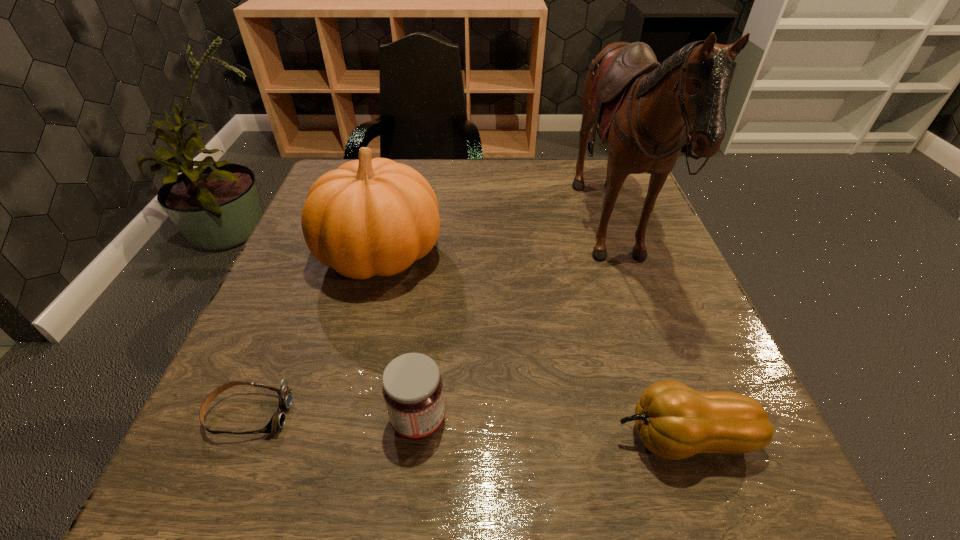
What are the coordinates of `free spot located 0.340m on the stem side of the gourd` in the screenshot? It's located at (379, 438).

You are a GUI agent. You are given a task and a screenshot of the screen. Output one action in this format:
    pyautogui.click(x=<x>, y=<y>)
    Task: Click on the vacant space situated 0.320m on the stem side of the gourd
    The width and height of the screenshot is (960, 540).
    Given the screenshot: What is the action you would take?
    pyautogui.click(x=393, y=438)

Image resolution: width=960 pixels, height=540 pixels. I want to click on vacant position located 0.140m on the stem side of the gourd, so click(x=517, y=438).

The width and height of the screenshot is (960, 540). I want to click on vacant space located on the front-facing side of the goggles, so click(x=335, y=414).

Where is `object that is positioned at the far edge`? object that is positioned at the far edge is located at coordinates coord(644,109).

The width and height of the screenshot is (960, 540). Identify the location of jam situated at the near edge. (412, 387).

Image resolution: width=960 pixels, height=540 pixels. I want to click on gourd that is at the near edge, so click(674, 421).

Locate an element on the screen. This screenshot has height=540, width=960. goggles that is positioned at the near edge is located at coordinates (277, 421).

The image size is (960, 540). I want to click on pumpkin located in the left edge section of the desktop, so click(369, 217).

Locate an element on the screen. goggles present at the left edge is located at coordinates (277, 421).